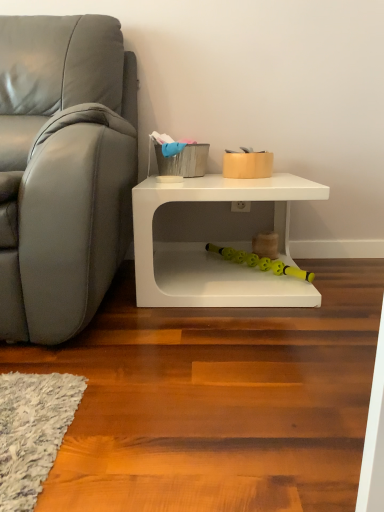
Question: Is yellow rubber toy at lower center, marked as the 2th toy in a top-to-bottom arrangement, next to matte gray couch at left and touching it?

Choices:
 (A) no
 (B) yes

Answer: (A)

Question: From a real-world perspective, is yellow rubber toy at lower center, positioned as the 1th toy in bottom-to-top order, on matte gray couch at left?

Choices:
 (A) no
 (B) yes

Answer: (A)

Question: Considering the relative sizes of yellow rubber toy at lower center, positioned as the 1th toy in bottom-to-top order, and matte gray couch at left in the image provided, is yellow rubber toy at lower center, positioned as the 1th toy in bottom-to-top order, smaller than matte gray couch at left?

Choices:
 (A) no
 (B) yes

Answer: (B)

Question: Can you confirm if yellow rubber toy at lower center, positioned as the 1th toy in bottom-to-top order, is wider than matte gray couch at left?

Choices:
 (A) yes
 (B) no

Answer: (B)

Question: From a real-world perspective, is yellow rubber toy at lower center, marked as the 2th toy in a top-to-bottom arrangement, beneath matte gray couch at left?

Choices:
 (A) no
 (B) yes

Answer: (B)

Question: From the image's perspective, does yellow rubber toy at lower center, marked as the 2th toy in a top-to-bottom arrangement, appear lower than matte gray couch at left?

Choices:
 (A) yes
 (B) no

Answer: (A)

Question: From the image's perspective, is white matte table at lower right below matte gold container at center, which is the 1th toy from top to bottom?

Choices:
 (A) no
 (B) yes

Answer: (B)

Question: Can you confirm if white matte table at lower right is positioned to the right of matte gold container at center, which is the 1th toy from top to bottom?

Choices:
 (A) yes
 (B) no

Answer: (B)

Question: Is white matte table at lower right at the left side of matte gold container at center, which is the 1th toy from top to bottom?

Choices:
 (A) no
 (B) yes

Answer: (B)

Question: Are white matte table at lower right and matte gold container at center, the second toy when ordered from bottom to top, far apart?

Choices:
 (A) no
 (B) yes

Answer: (A)

Question: Considering the relative sizes of white matte table at lower right and matte gold container at center, which is the 1th toy from top to bottom, in the image provided, is white matte table at lower right wider than matte gold container at center, which is the 1th toy from top to bottom,?

Choices:
 (A) yes
 (B) no

Answer: (A)

Question: Is white matte table at lower right next to matte gold container at center, the second toy when ordered from bottom to top?

Choices:
 (A) no
 (B) yes

Answer: (A)

Question: Is white matte table at lower right at the left side of yellow rubber toy at lower center, positioned as the 1th toy in bottom-to-top order?

Choices:
 (A) no
 (B) yes

Answer: (B)